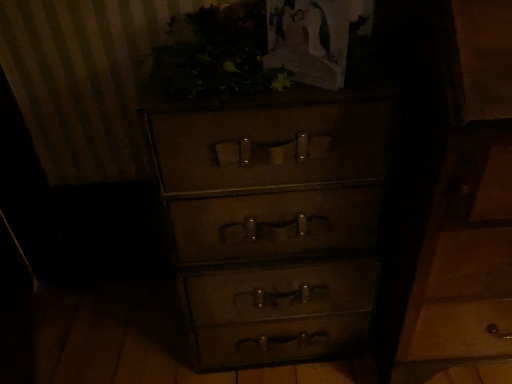
Where is `green leafy plant at upper center`? The height and width of the screenshot is (384, 512). green leafy plant at upper center is located at coordinates (217, 54).

The image size is (512, 384). What do you see at coordinates (217, 54) in the screenshot?
I see `green leafy plant at upper center` at bounding box center [217, 54].

Describe the element at coordinates (341, 218) in the screenshot. I see `matte brown chest of drawers at center` at that location.

Where is `matte brown chest of drawers at center`? Image resolution: width=512 pixels, height=384 pixels. matte brown chest of drawers at center is located at coordinates point(341,218).

What are the coordinates of `green leafy plant at upper center` in the screenshot? It's located at (217, 54).

Considering the relative positions of matte brown chest of drawers at center and green leafy plant at upper center in the image provided, is matte brown chest of drawers at center to the left of green leafy plant at upper center from the viewer's perspective?

No, matte brown chest of drawers at center is not to the left of green leafy plant at upper center.

Which object is further away from the camera taking this photo, matte brown chest of drawers at center or green leafy plant at upper center?

matte brown chest of drawers at center is further away from the camera.

Which is behind, point (340, 240) or point (193, 73)?

The point (340, 240) is behind.

From the image's perspective, is matte brown chest of drawers at center on top of green leafy plant at upper center?

No, from the image's perspective, matte brown chest of drawers at center is not on top of green leafy plant at upper center.

From the picture: From a real-world perspective, does matte brown chest of drawers at center sit lower than green leafy plant at upper center?

Yes, from a real-world perspective, matte brown chest of drawers at center is under green leafy plant at upper center.

Does matte brown chest of drawers at center have a lesser width compared to green leafy plant at upper center?

No.

From their relative heights in the image, would you say matte brown chest of drawers at center is taller or shorter than green leafy plant at upper center?

In the image, matte brown chest of drawers at center appears to be taller than green leafy plant at upper center.

Considering the sizes of objects matte brown chest of drawers at center and green leafy plant at upper center in the image provided, who is smaller, matte brown chest of drawers at center or green leafy plant at upper center?

Smaller between the two is green leafy plant at upper center.

Is matte brown chest of drawers at center outside of green leafy plant at upper center?

Yes, matte brown chest of drawers at center is located beyond the bounds of green leafy plant at upper center.

Is matte brown chest of drawers at center beside green leafy plant at upper center?

There is a gap between matte brown chest of drawers at center and green leafy plant at upper center.

Is matte brown chest of drawers at center facing away from green leafy plant at upper center?

matte brown chest of drawers at center does not have its back to green leafy plant at upper center.

How many degrees apart are the facing directions of matte brown chest of drawers at center and green leafy plant at upper center?

matte brown chest of drawers at center and green leafy plant at upper center are facing 1.66 degrees away from each other.

Measure the distance between matte brown chest of drawers at center and green leafy plant at upper center.

They are 11.74 inches apart.

At what (x,y) coordinates should I click in order to perform the action: click on the chest of drawers located behind the green leafy plant at upper center. Please return your answer as a coordinate pair (x, y). This screenshot has height=384, width=512. Looking at the image, I should click on (341, 218).

Is green leafy plant at upper center to the left or to the right of matte brown chest of drawers at center in the image?

Based on their positions, green leafy plant at upper center is located to the left of matte brown chest of drawers at center.

Does green leafy plant at upper center come behind matte brown chest of drawers at center?

No, green leafy plant at upper center is closer to the camera.

Considering the positions of point (220, 31) and point (316, 248), is point (220, 31) closer or farther from the camera than point (316, 248)?

Point (220, 31) is positioned closer to the camera compared to point (316, 248).

In the scene shown: From the image's perspective, which is above, green leafy plant at upper center or matte brown chest of drawers at center?

green leafy plant at upper center, from the image's perspective.

From a real-world perspective, which object rests below the other?

matte brown chest of drawers at center.

Between green leafy plant at upper center and matte brown chest of drawers at center, which one has smaller width?

→ With smaller width is green leafy plant at upper center.

In terms of height, does green leafy plant at upper center look taller or shorter compared to matte brown chest of drawers at center?

green leafy plant at upper center is shorter than matte brown chest of drawers at center.

Looking at this image, which of these two, green leafy plant at upper center or matte brown chest of drawers at center, is bigger?

matte brown chest of drawers at center is bigger.

Is green leafy plant at upper center not inside matte brown chest of drawers at center?

Absolutely, green leafy plant at upper center is external to matte brown chest of drawers at center.

Is green leafy plant at upper center in contact with matte brown chest of drawers at center?

No, green leafy plant at upper center is not touching matte brown chest of drawers at center.

Does green leafy plant at upper center turn towards matte brown chest of drawers at center?

No, green leafy plant at upper center does not turn towards matte brown chest of drawers at center.

Can you tell me how much green leafy plant at upper center and matte brown chest of drawers at center differ in facing direction?

The facing directions of green leafy plant at upper center and matte brown chest of drawers at center are 1.66 degrees apart.

Where is `chest of drawers behind the green leafy plant at upper center`? chest of drawers behind the green leafy plant at upper center is located at coordinates (341, 218).

You are a GUI agent. You are given a task and a screenshot of the screen. Output one action in this format:
    pyautogui.click(x=<x>, y=<y>)
    Task: Click on the vegetation on the left side of matte brown chest of drawers at center
    This screenshot has height=384, width=512.
    Given the screenshot: What is the action you would take?
    pyautogui.click(x=217, y=54)

At what (x,y) coordinates should I click in order to perform the action: click on the chest of drawers directly beneath the green leafy plant at upper center (from a real-world perspective). Please return your answer as a coordinate pair (x, y). The image size is (512, 384). Looking at the image, I should click on (341, 218).